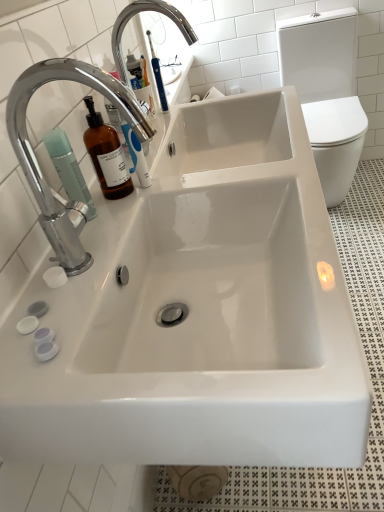
The image size is (384, 512). What are the coordinates of `vacant location behind chrome/metallic faucet at upper left, the second tap when ordered from back to front` in the screenshot? It's located at (125, 209).